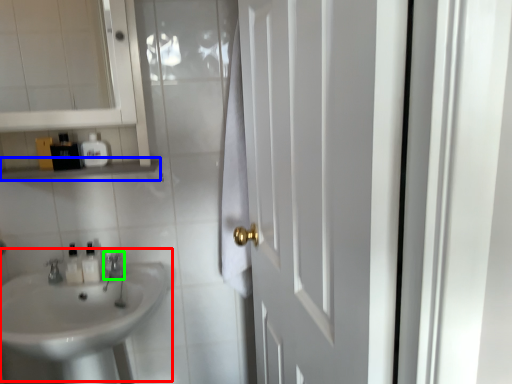
Question: Estimate the real-world distances between objects in this image. Which object is farther from sink (highlighted by a red box), balustrade (highlighted by a blue box) or faucet (highlighted by a green box)?

Choices:
 (A) balustrade
 (B) faucet

Answer: (A)